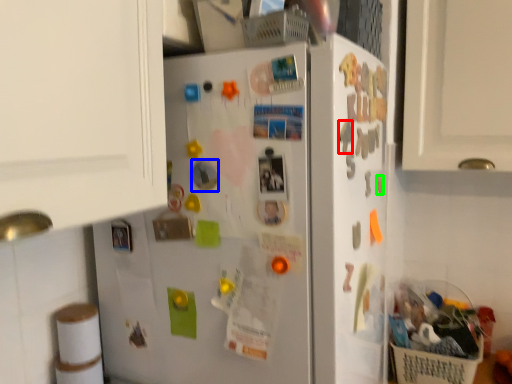
Question: Considering the real-world distances, which object is closest to magnet (highlighted by a red box)? magnet (highlighted by a blue box) or magnet (highlighted by a green box).

Choices:
 (A) magnet
 (B) magnet

Answer: (A)